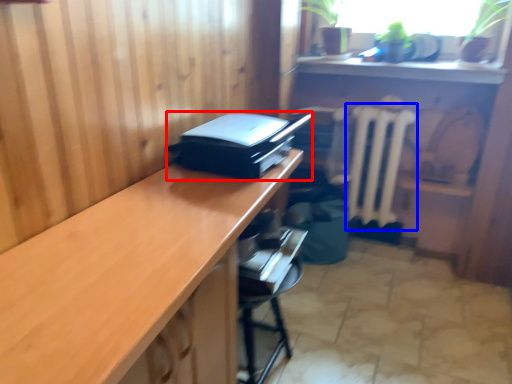
Question: Among these objects, which one is nearest to the camera, printer (highlighted by a red box) or radiator (highlighted by a blue box)?

Choices:
 (A) printer
 (B) radiator

Answer: (A)